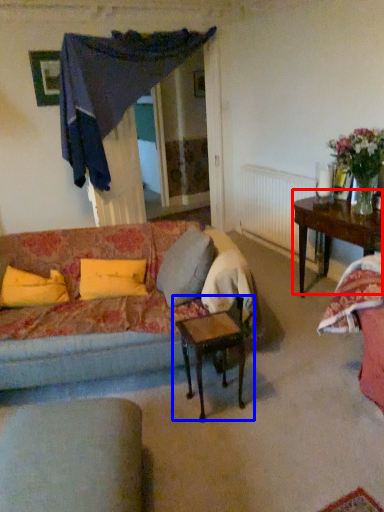
Question: Which point is further to the camera, table (highlighted by a red box) or table (highlighted by a blue box)?

Choices:
 (A) table
 (B) table

Answer: (A)